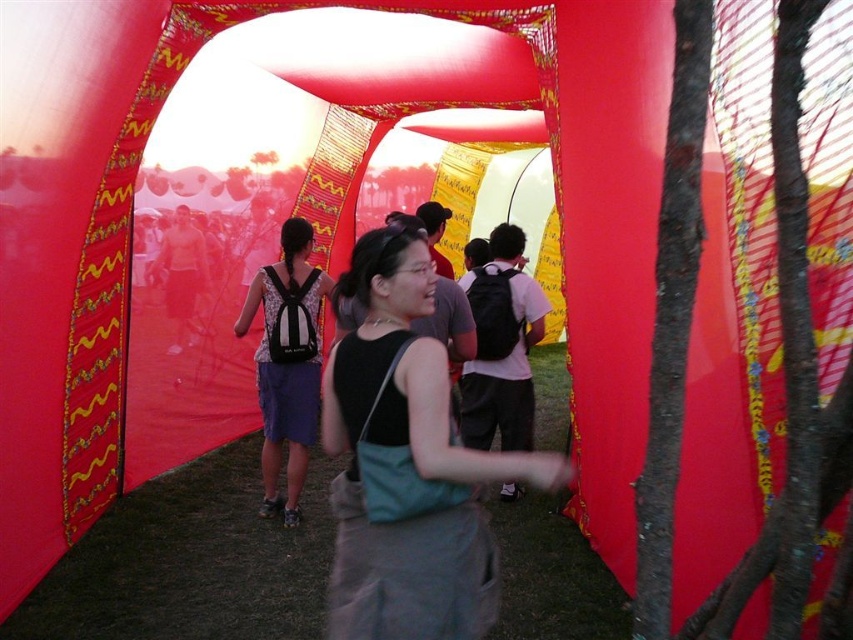
You are standing in front of the inflatable structure and see the black fabric bag at center. If you want to reach into your pocket to grab your keys, will you be able to do so without moving your body?

The black fabric bag at center is 1.77 meters from viewer, which is too far to reach without moving your body.

You are organizing a backpacking trip and need to choose between the black fabric bag at center and the matte black backpack at center. Which one has a greater width?

The black fabric bag at center has a greater width than the matte black backpack at center.

You are organizing a backpacking trip and need to choose between the black fabric bag at center and the matte black backpack at center. Based on their sizes, which one would you recommend for carrying more gear?

The matte black backpack at center is taller than the black fabric bag at center, so it can carry more gear.